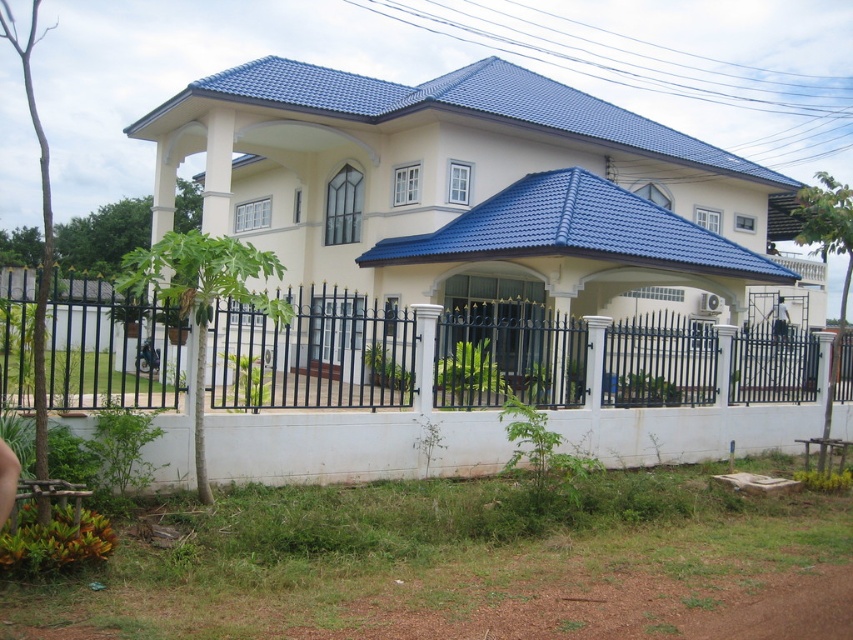
Question: Does black metal fence at lower center appear on the right side of dark blue fabric shirt at center?

Choices:
 (A) yes
 (B) no

Answer: (B)

Question: Is black metal fence at lower center below dark blue fabric shirt at center?

Choices:
 (A) no
 (B) yes

Answer: (A)

Question: Can you confirm if black metal fence at lower center is wider than dark blue fabric shirt at center?

Choices:
 (A) no
 (B) yes

Answer: (B)